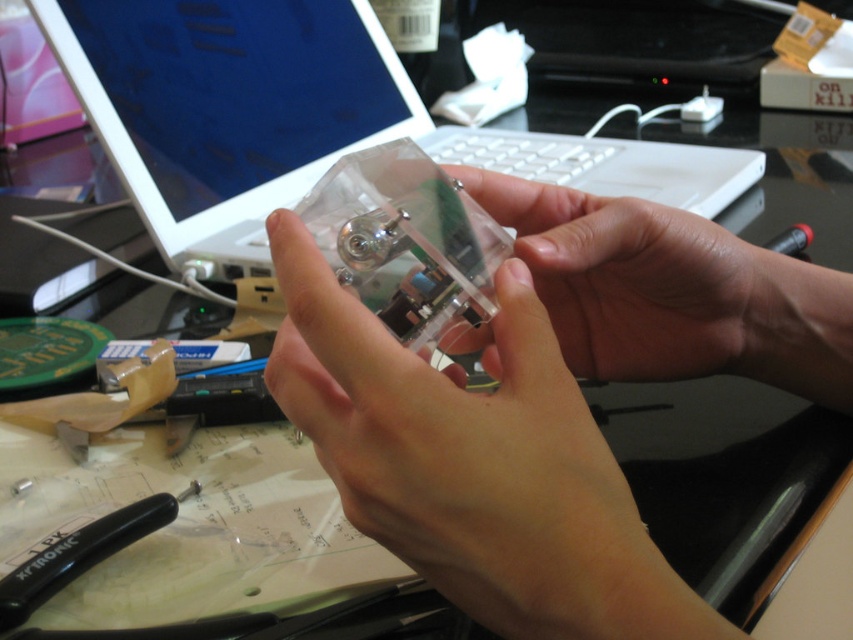
Question: Is transparent plastic object at center to the right of white plastic laptop at upper center from the viewer's perspective?

Choices:
 (A) no
 (B) yes

Answer: (B)

Question: Can you confirm if transparent plastic object at center is wider than white plastic laptop at upper center?

Choices:
 (A) yes
 (B) no

Answer: (B)

Question: Does transparent plastic object at center come behind white plastic laptop at upper center?

Choices:
 (A) yes
 (B) no

Answer: (B)